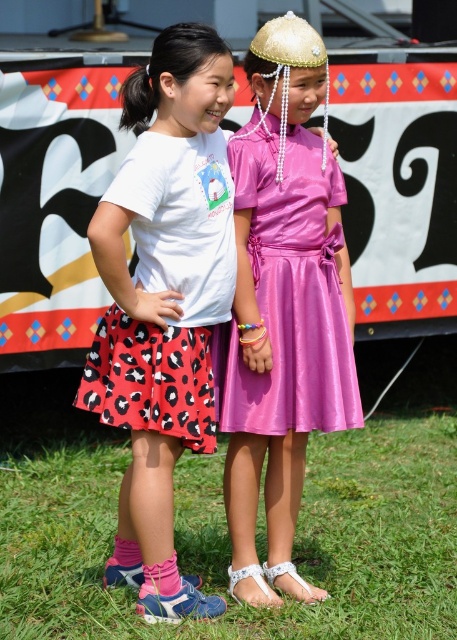
Question: Which point appears farthest from the camera in this image?

Choices:
 (A) (149, 141)
 (B) (237, 141)
 (C) (8, 468)

Answer: (C)

Question: Is red polka dot skirt at center above shiny pink dress at center?

Choices:
 (A) yes
 (B) no

Answer: (B)

Question: Which point appears closest to the camera in this image?

Choices:
 (A) (81, 529)
 (B) (189, 262)

Answer: (B)

Question: Which point is farther from the camera taking this photo?

Choices:
 (A) (68, 488)
 (B) (207, 244)
 (C) (230, 326)

Answer: (A)

Question: Can you confirm if green grass at lower center is thinner than shiny pink dress at center?

Choices:
 (A) yes
 (B) no

Answer: (B)

Question: Does green grass at lower center appear under shiny pink dress at center?

Choices:
 (A) yes
 (B) no

Answer: (A)